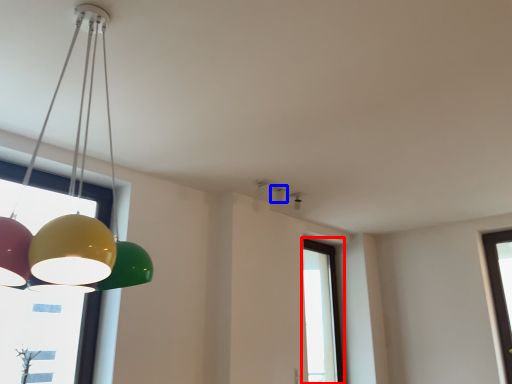
Question: Which point is closer to the camera, window (highlighted by a red box) or lamp (highlighted by a blue box)?

Choices:
 (A) window
 (B) lamp

Answer: (B)